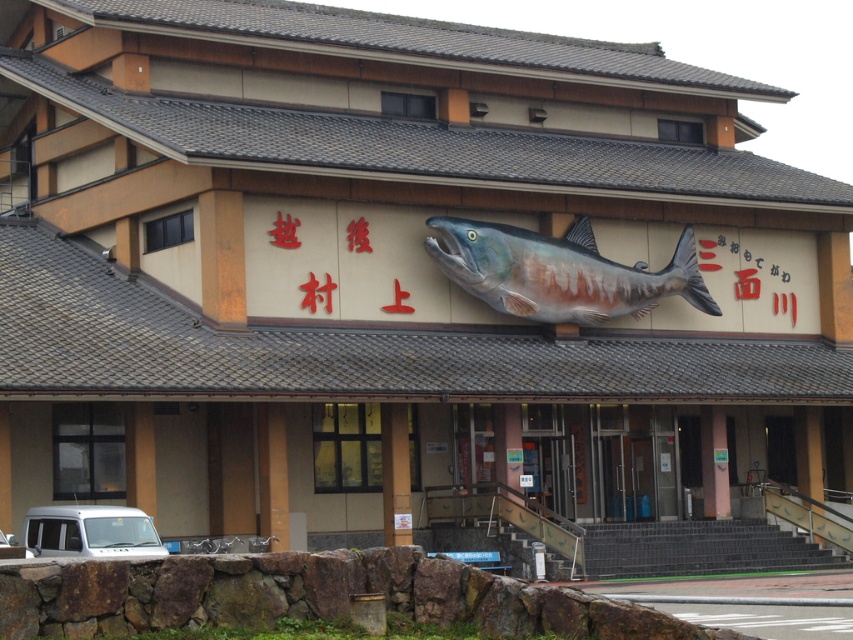
You are a delivery driver who needs to park your white matte van at lower left near the shiny metallic fish at center. The parking spot requires vehicles to be within 50 feet of the landmark. Will your van comply with the parking rule?

The distance between the shiny metallic fish at center and the white matte van at lower left is 52.01 feet, which exceeds the 50 feet requirement. Therefore, the van is too far to comply with the parking rule.

You are a delivery person trying to park your white matte van at lower left in a parking spot that can only accommodate vehicles narrower than the silver metallic van at lower left. Can your van fit in the spot?

The silver metallic van at lower left is narrower than the white matte van at lower left. Since the parking spot can only accommodate vehicles narrower than the silver metallic van at lower left, the white matte van at lower left cannot fit in the spot because it is wider.

You are a delivery driver who needs to park your silver metallic van at lower left near the entrance of the building. However, there is a shiny metallic fish at center mounted on the wall above the entrance. Can you park your van without blocking the fish sculpture?

The shiny metallic fish at center might be wider than silver metallic van at lower left. Since the fish is mounted on the wall above the entrance, parking the van near the entrance should not block the sculpture as it is positioned above. However, ensure the van does not extend beyond the entrance area to avoid obstructing the view of the fish.